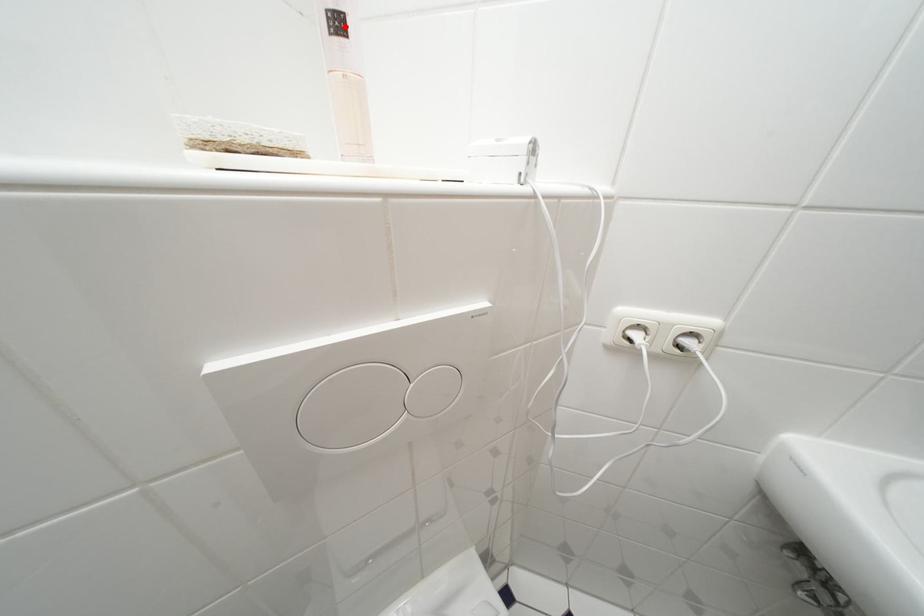
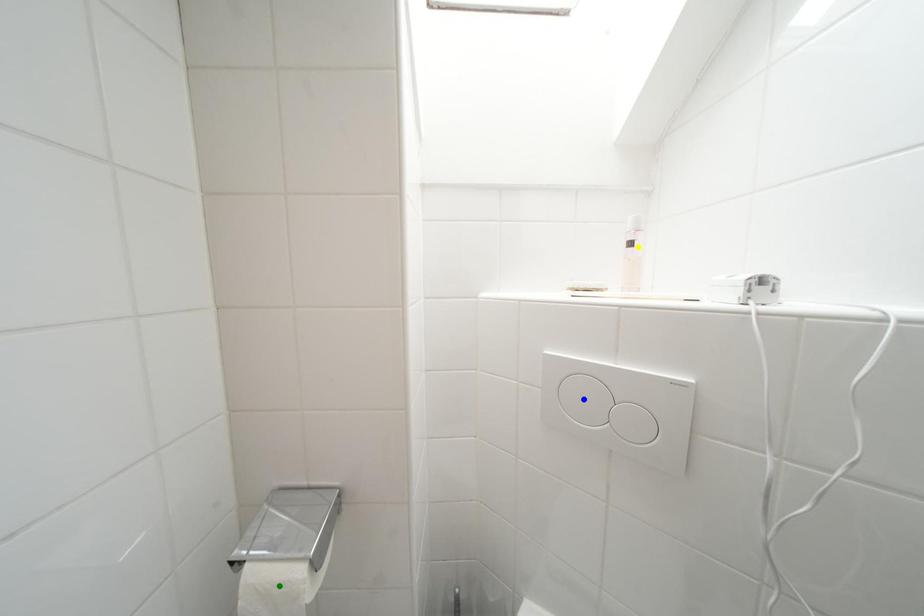
Question: I am providing you with two images of the same scene from different viewpoints. A red point is marked on the first image. You are given multiple points on the second image. Which mark in image 2 goes with the point in image 1?

Choices:
 (A) blue point
 (B) green point
 (C) yellow point

Answer: (C)